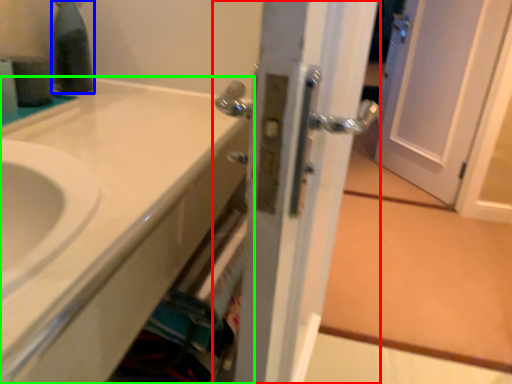
Question: Which object is the farthest from door (highlighted by a red box)? Choose among these: bottle (highlighted by a blue box) or bathroom cabinet (highlighted by a green box).

Choices:
 (A) bottle
 (B) bathroom cabinet

Answer: (A)